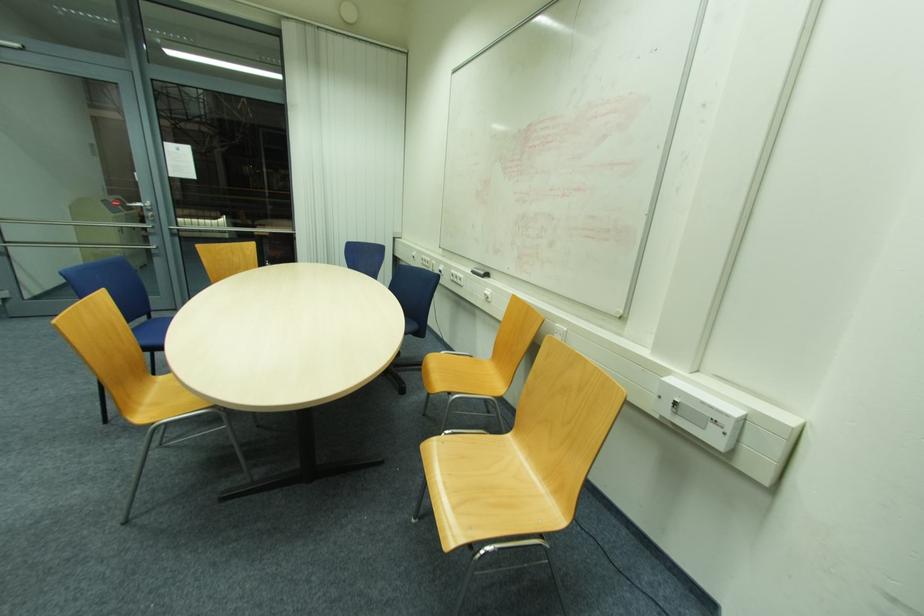
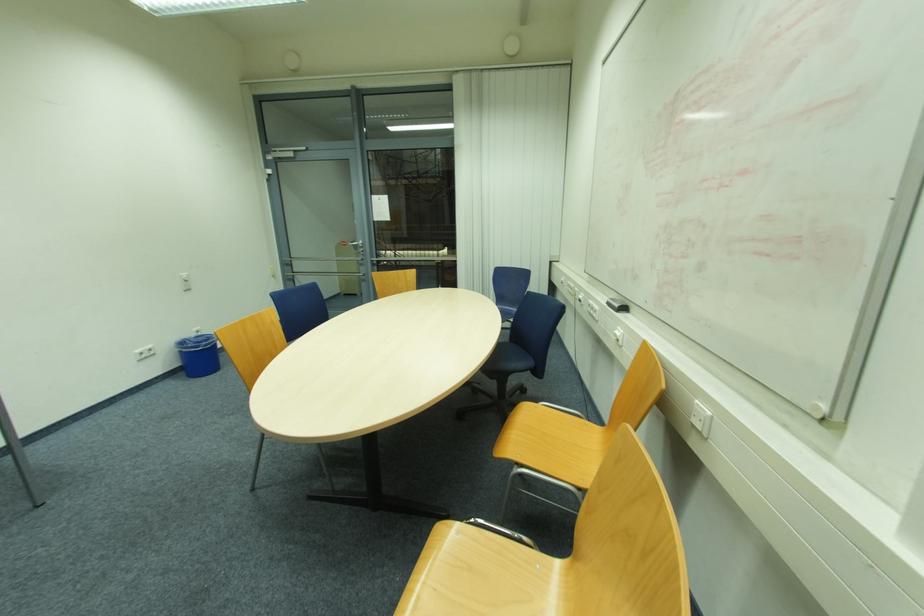
Question: The first image is from the beginning of the video and the second image is from the end. How did the camera likely rotate when shooting the video?

Choices:
 (A) Left
 (B) Right
 (C) Up
 (D) Down

Answer: (A)